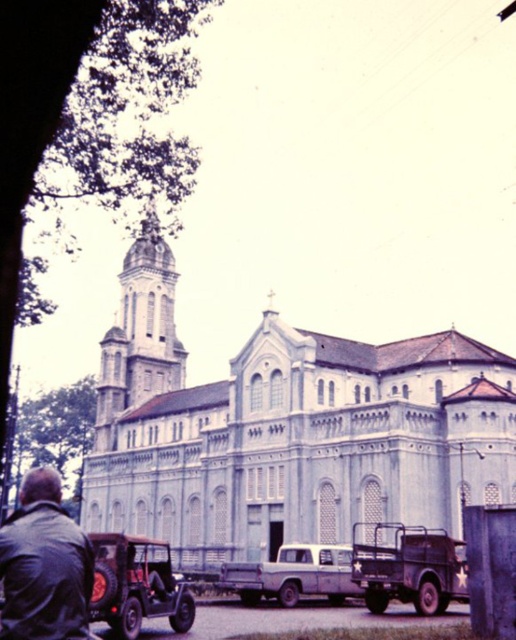
You are a visitor arriving at the church and need to park your car. You see the rustic brown jeep at lower left and the matte gray truck at center. Which parking spot is closer to the entrance of the church?

The rustic brown jeep at lower left is to the left of the matte gray truck at center, so the matte gray truck at center is closer to the entrance of the church.

You are standing in front of the light gray stone church at center and want to place the brown leather jacket at lower left on the ground. Considering their widths, which object occupies more horizontal space?

The light gray stone church at center is wider than the brown leather jacket at lower left, so it occupies more horizontal space.

You are standing in front of the church and want to determine the relative positions of two points marked on the ground. Which point is closer to you, point 1 at coordinates (146, 573) or point 2 at coordinates (288, 557)?

Point 1 at coordinates (146, 573) is closer to you than point 2 at coordinates (288, 557).